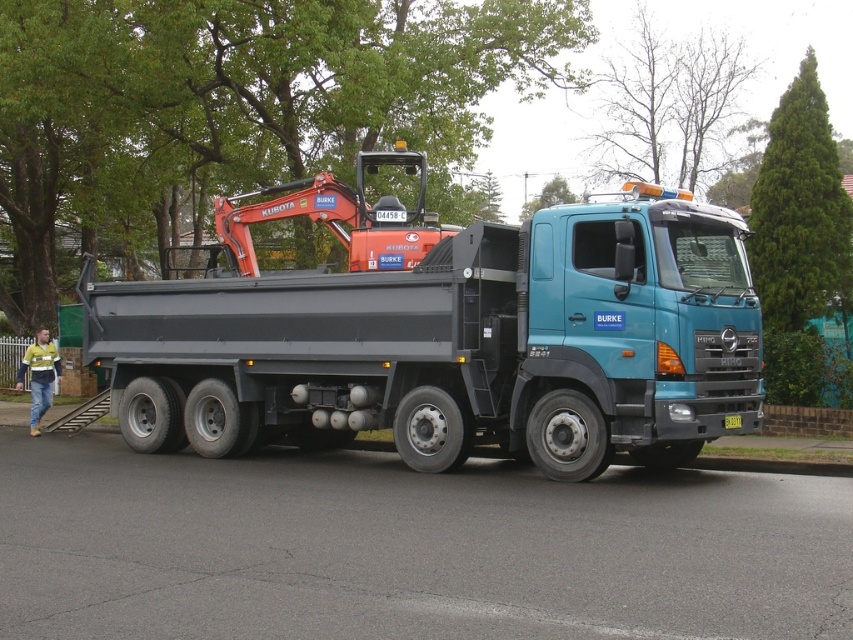
Does matte black truck at center appear over orange metallic excavator at center?

Incorrect, matte black truck at center is not positioned above orange metallic excavator at center.

The height and width of the screenshot is (640, 853). Find the location of `matte black truck at center`. matte black truck at center is located at coordinates (456, 344).